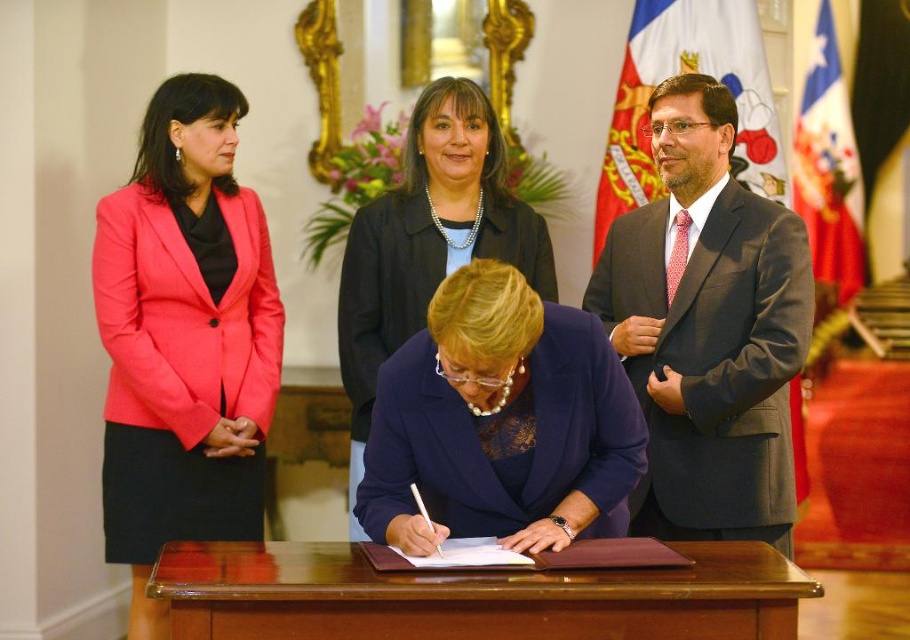
You are organizing a charity event and need to display two items from the image. The matte pink blazer at left and the navy blue fabric at center must be placed on a shelf. Given that the shelf has limited space, which item should you choose to place first to ensure both fit?

The navy blue fabric at center should be placed first because it is smaller in size than the matte pink blazer at left, allowing both to fit on the shelf.

You are a photographer positioned at the back of the room. You need to capture a clear photo of the dark gray suit at right and the white fabric flag at upper right. Which object will appear larger in your photo?

The dark gray suit at right is closer to the viewer than the white fabric flag at upper right, so it will appear larger in the photo.

What is the color of the blazer located at the coordinates point (428, 241)?

The matte black blazer at center is located at point (428, 241), so the color is black.